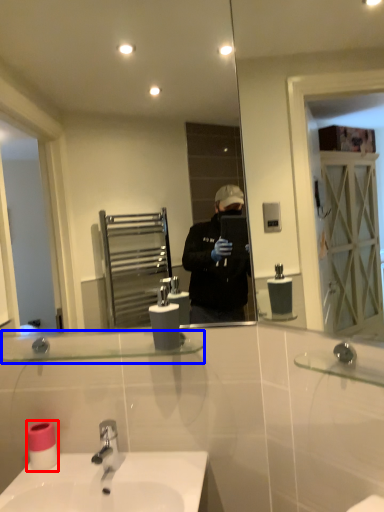
Question: Among these objects, which one is farthest to the camera, toilet paper (highlighted by a red box) or balustrade (highlighted by a blue box)?

Choices:
 (A) toilet paper
 (B) balustrade

Answer: (A)